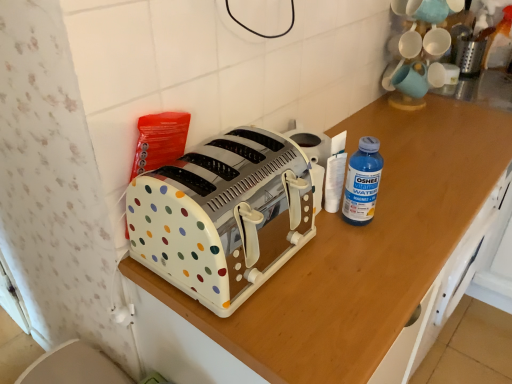
Question: Choose the correct answer: Is blue plastic bottle at right inside white polka dot plastic toaster at center or outside it?

Choices:
 (A) inside
 (B) outside

Answer: (B)

Question: Is blue plastic bottle at right taller or shorter than white polka dot plastic toaster at center?

Choices:
 (A) short
 (B) tall

Answer: (A)

Question: Which object is positioned closest to the white plastic toaster at center?

Choices:
 (A) metallic silver grater at upper right
 (B) blue plastic bottle at right
 (C) white polka dot plastic toaster at center

Answer: (C)

Question: Estimate the real-world distances between objects in this image. Which object is farther from the white plastic toaster at center?

Choices:
 (A) blue plastic bottle at right
 (B) white polka dot plastic toaster at center
 (C) metallic silver grater at upper right

Answer: (C)